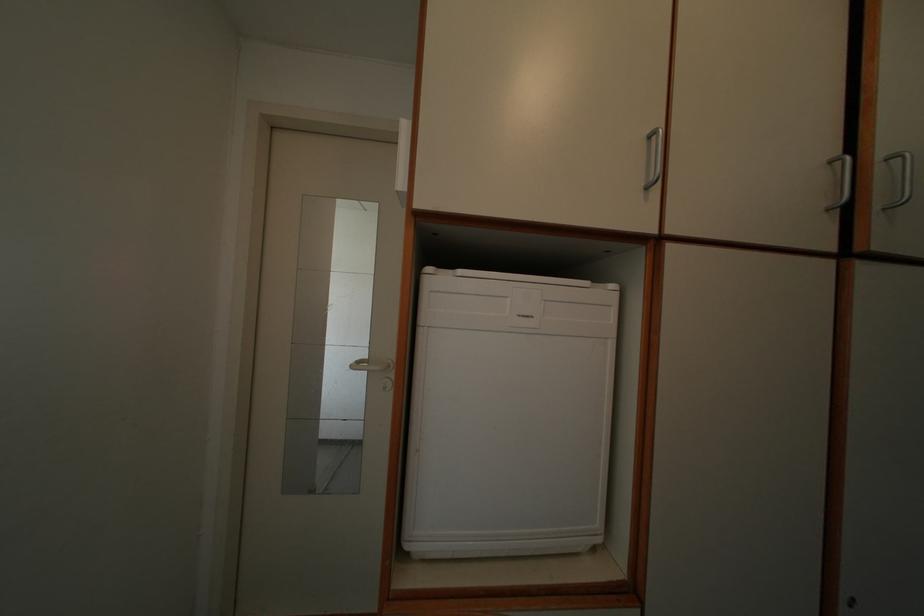
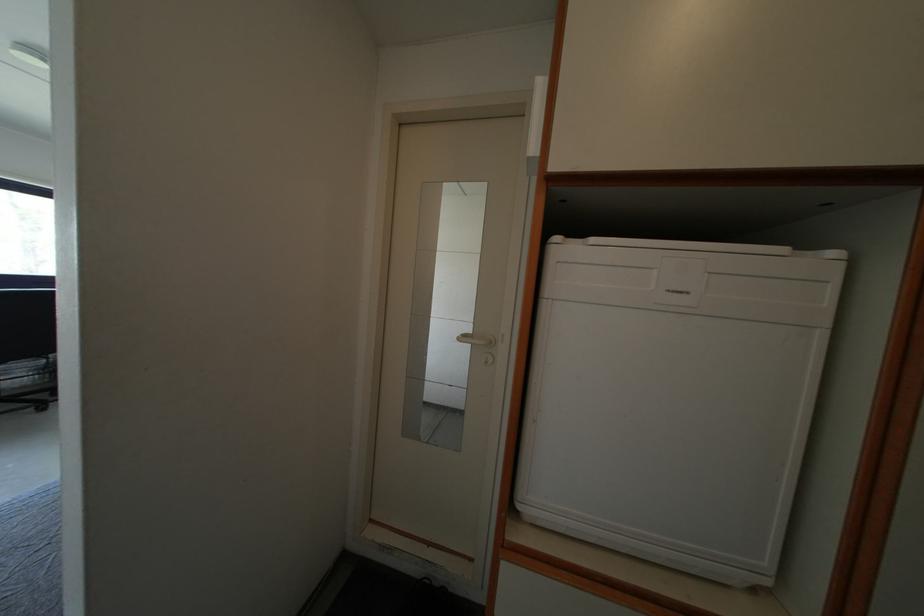
Question: In a continuous first-person perspective shot, in which direction is the camera moving?

Choices:
 (A) Left
 (B) Right
 (C) Forward
 (D) Backward

Answer: (A)